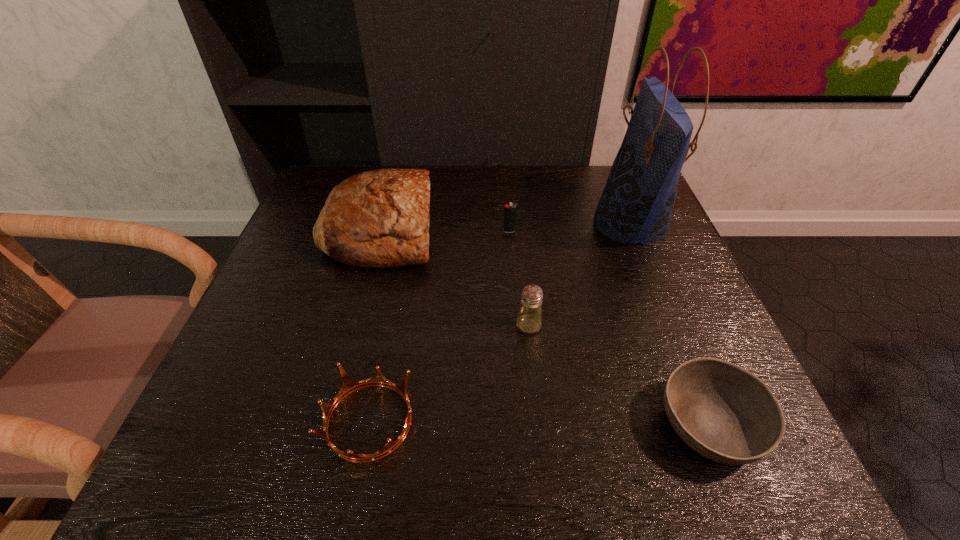
The width and height of the screenshot is (960, 540). In order to click on free space that satisfies the following two spatial constraints: 1. on the back side of the crown; 2. on the right side of the fourth farthest object in this screenshot , I will do `click(388, 326)`.

Where is `vacant space that satisfies the following two spatial constraints: 1. on the front side of the igniter; 2. on the left side of the fourth shortest object`? This screenshot has width=960, height=540. vacant space that satisfies the following two spatial constraints: 1. on the front side of the igniter; 2. on the left side of the fourth shortest object is located at coordinates [x=516, y=326].

Find the location of a particular element. This screenshot has height=540, width=960. free region that satisfies the following two spatial constraints: 1. at the sliced front of the third shortest object; 2. on the left side of the second tallest object is located at coordinates (380, 231).

Image resolution: width=960 pixels, height=540 pixels. Find the location of `free space that satisfies the following two spatial constraints: 1. at the sliced front of the bread; 2. on the left side of the crown`. free space that satisfies the following two spatial constraints: 1. at the sliced front of the bread; 2. on the left side of the crown is located at coordinates (330, 421).

Locate an element on the screen. The width and height of the screenshot is (960, 540). free spot that satisfies the following two spatial constraints: 1. at the sliced front of the bread; 2. on the right side of the crown is located at coordinates (330, 421).

This screenshot has height=540, width=960. What are the coordinates of `free location that satisfies the following two spatial constraints: 1. at the sliced front of the third nearest object; 2. on the right side of the bread` in the screenshot? It's located at (355, 326).

The image size is (960, 540). I want to click on free location that satisfies the following two spatial constraints: 1. at the sliced front of the bowl; 2. on the right side of the bread, so click(329, 426).

Find the location of a particular element. This screenshot has width=960, height=540. vacant area that satisfies the following two spatial constraints: 1. at the sliced front of the bread; 2. on the back side of the third tallest object is located at coordinates (355, 326).

Where is `vacant area in the image that satisfies the following two spatial constraints: 1. on the back side of the tallest object; 2. on the right side of the third shortest object`? The height and width of the screenshot is (540, 960). vacant area in the image that satisfies the following two spatial constraints: 1. on the back side of the tallest object; 2. on the right side of the third shortest object is located at coordinates (509, 224).